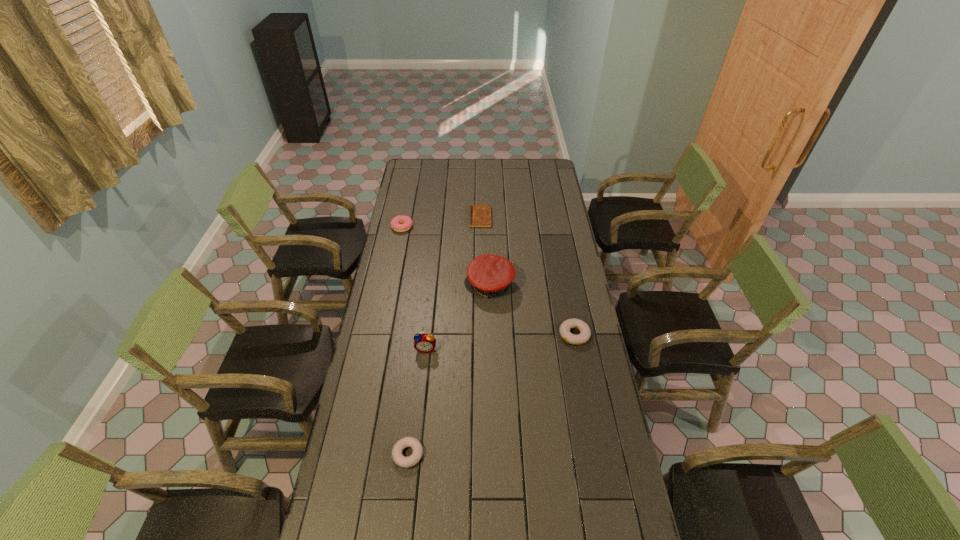
Locate an element on the screen. The width and height of the screenshot is (960, 540). object that is at the right edge is located at coordinates point(585,333).

In the image, there is a desktop. At what (x,y) coordinates should I click in order to perform the action: click on vacant space at the far edge. Please return your answer as a coordinate pair (x, y). The height and width of the screenshot is (540, 960). Looking at the image, I should click on (497, 177).

In the image, there is a desktop. Identify the location of blank space at the near edge. The image size is (960, 540). (572, 526).

In the image, there is a desktop. At what (x,y) coordinates should I click in order to perform the action: click on vacant space at the left edge. Please return your answer as a coordinate pair (x, y). The image size is (960, 540). Looking at the image, I should click on (416, 194).

Where is `vacant space at the right edge of the desktop`? The image size is (960, 540). vacant space at the right edge of the desktop is located at coordinates (598, 468).

At what (x,y) coordinates should I click in order to perform the action: click on vacant space at the far left corner of the desktop. Please return your answer as a coordinate pair (x, y). This screenshot has width=960, height=540. Looking at the image, I should click on (408, 172).

Identify the location of vacant space at the far right corner of the desktop. The height and width of the screenshot is (540, 960). (535, 159).

What are the coordinates of `free space that is in between the farthest doughnut and the nearest object` in the screenshot? It's located at (405, 341).

The image size is (960, 540). Find the location of `free space between the rightmost doughnut and the shortest object`. free space between the rightmost doughnut and the shortest object is located at coordinates (527, 276).

This screenshot has height=540, width=960. I want to click on vacant region between the shortest doughnut and the leftmost object, so click(x=405, y=341).